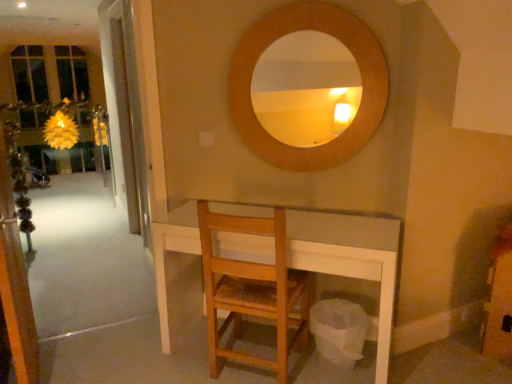
The width and height of the screenshot is (512, 384). I want to click on free spot in front of clear glass door at left, the first screen door in the back-to-front sequence, so click(109, 273).